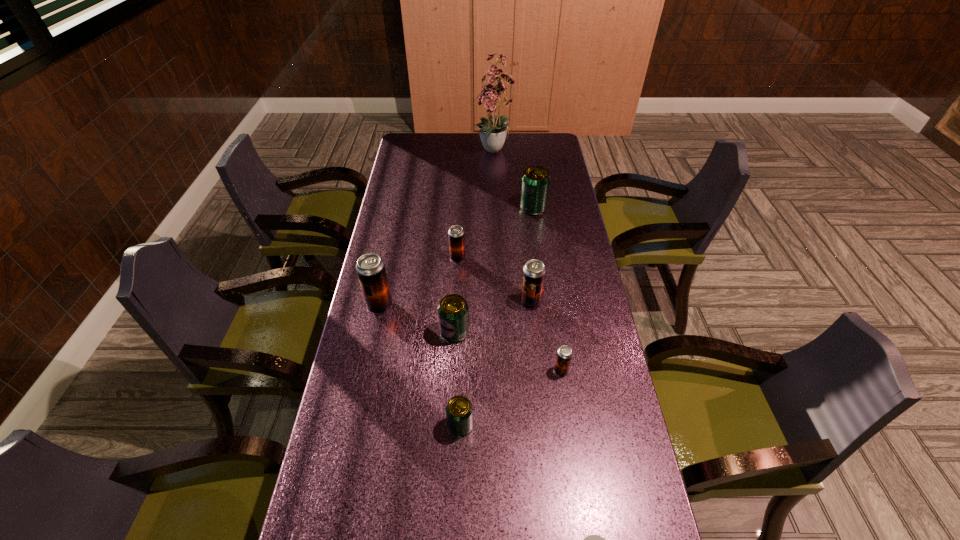
Locate which beer can ranks fifth in proximity to the farthest green beer can. Please provide its 2D coordinates. Your answer should be formatted as a tuple, i.e. [(x, y)], where the tuple contains the x and y coordinates of a point satisfying the conditions above.

[(564, 354)]

Point out which beer can is positioned as the third nearest to the fourth nearest object. Please provide its 2D coordinates. Your answer should be formatted as a tuple, i.e. [(x, y)], where the tuple contains the x and y coordinates of a point satisfying the conditions above.

[(459, 411)]

Select which black beer can appears as the closest to the smallest green beer can. Please provide its 2D coordinates. Your answer should be formatted as a tuple, i.e. [(x, y)], where the tuple contains the x and y coordinates of a point satisfying the conditions above.

[(564, 354)]

In order to click on black beer can that is the third nearest to the third nearest object in this screenshot , I will do `click(370, 268)`.

Where is `green beer can that stands as the closest to the second farthest green beer can`? green beer can that stands as the closest to the second farthest green beer can is located at coordinates (459, 411).

You are a GUI agent. You are given a task and a screenshot of the screen. Output one action in this format:
    pyautogui.click(x=<x>, y=<y>)
    Task: Click on the closest green beer can to the third nearest beer can
    This screenshot has height=540, width=960.
    Given the screenshot: What is the action you would take?
    pyautogui.click(x=459, y=411)

Image resolution: width=960 pixels, height=540 pixels. Identify the location of free point that satisfies the following two spatial constraints: 1. on the front-facing side of the flower arrangement; 2. on the left side of the nearest black beer can. (505, 371).

At what (x,y) coordinates should I click in order to perform the action: click on vacant region that satisfies the following two spatial constraints: 1. on the back side of the second biggest black beer can; 2. on the left side of the nearest green beer can. Please return your answer as a coordinate pair (x, y). Looking at the image, I should click on coord(465,302).

Identify the location of free space that satisfies the following two spatial constraints: 1. on the back side of the second nearest object; 2. on the left side of the eighth nearest object. (468, 208).